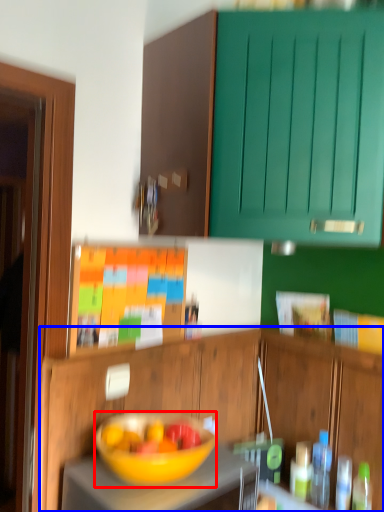
Question: Which of the following is the closest to the observer, bowl (highlighted by a red box) or cabinetry (highlighted by a blue box)?

Choices:
 (A) bowl
 (B) cabinetry

Answer: (A)